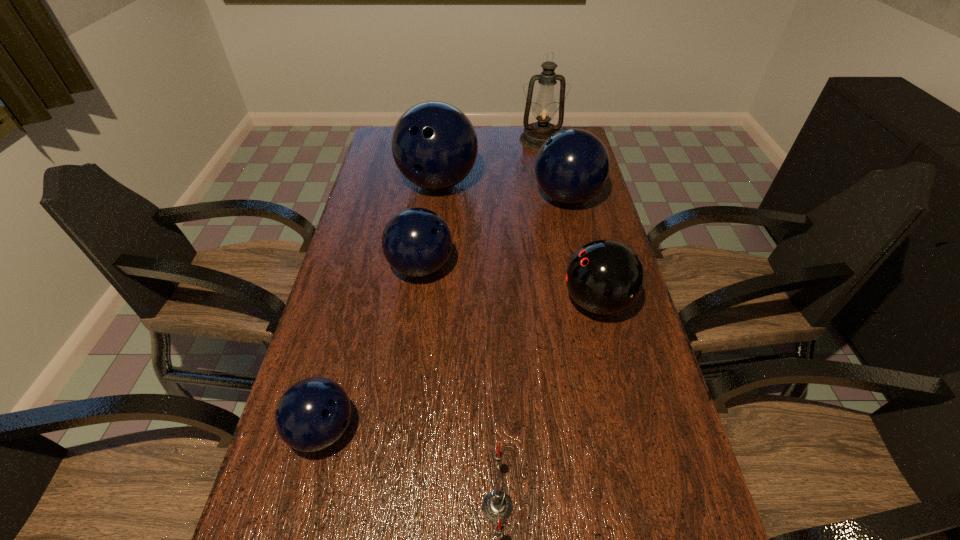
In order to click on the farthest object in this screenshot , I will do `click(544, 110)`.

Find the location of a particular element. the tallest bowling ball is located at coordinates (434, 144).

This screenshot has width=960, height=540. Find the location of `the second tallest object`. the second tallest object is located at coordinates click(434, 144).

What are the coordinates of `the second tallest bowling ball` in the screenshot? It's located at (572, 166).

Find the location of a particular element. The width and height of the screenshot is (960, 540). the third tallest object is located at coordinates (x=572, y=166).

Where is `the third biggest blue bowling ball`? the third biggest blue bowling ball is located at coordinates (416, 242).

You are a GUI agent. You are given a task and a screenshot of the screen. Output one action in this format:
    pyautogui.click(x=<x>, y=<y>)
    Task: Click on the black bowling ball
    Image resolution: width=960 pixels, height=540 pixels.
    Given the screenshot: What is the action you would take?
    pyautogui.click(x=604, y=277)

Locate an element on the screen. This screenshot has width=960, height=540. the shortest bowling ball is located at coordinates (314, 413).

Identify the location of the sixth farthest object. The height and width of the screenshot is (540, 960). (314, 413).

Identify the location of vacant space located on the front of the oil lamp. Image resolution: width=960 pixels, height=540 pixels. (549, 178).